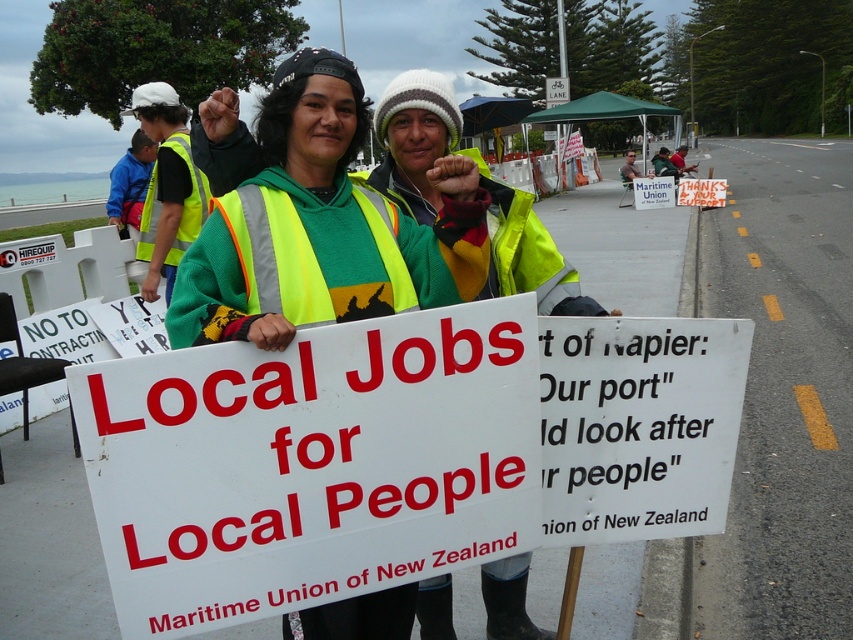
You are a photographer trying to capture the protest scene. You notice the white paper sign at center and the reflective yellow vest at center. Which object would appear wider in your photo?

The white paper sign at center appears wider than the reflective yellow vest at center because its width surpasses the vest.